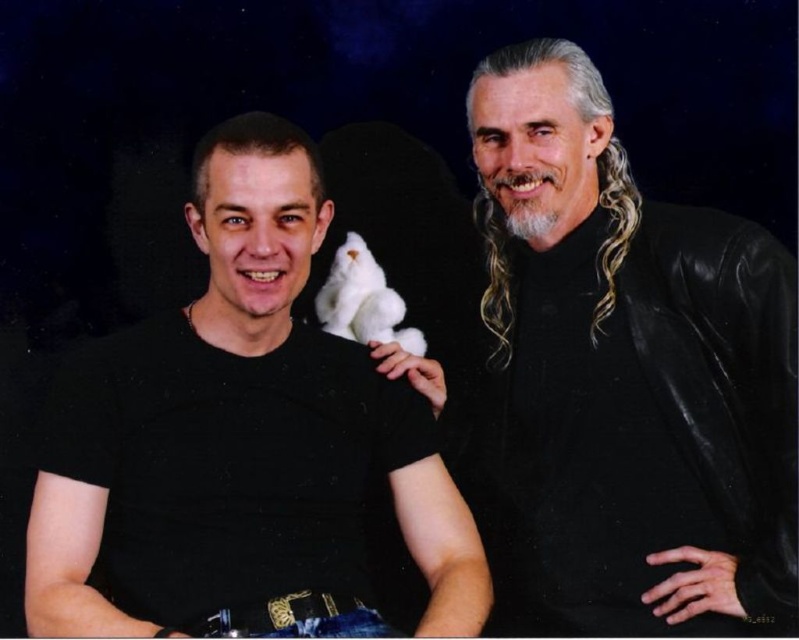
In the scene shown: You are standing in front of a photo of two people under a starry night sky. The photo includes a black matte t shirt at left and a black leather jacket at right. Which object is exactly at the coordinate point [301,392]?

The black matte t shirt at left is exactly at the coordinate point [301,392].